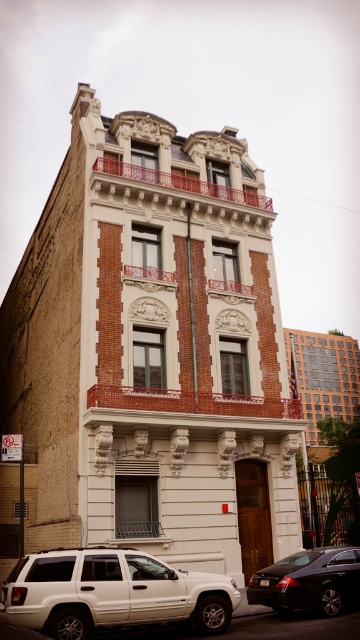
Who is taller, white matte suv at lower left or shiny black sedan at lower right?

white matte suv at lower left is taller.

Between white matte suv at lower left and shiny black sedan at lower right, which one appears on the right side from the viewer's perspective?

From the viewer's perspective, shiny black sedan at lower right appears more on the right side.

Image resolution: width=360 pixels, height=640 pixels. What do you see at coordinates (111, 593) in the screenshot?
I see `white matte suv at lower left` at bounding box center [111, 593].

Locate an element on the screen. This screenshot has height=640, width=360. white matte suv at lower left is located at coordinates (111, 593).